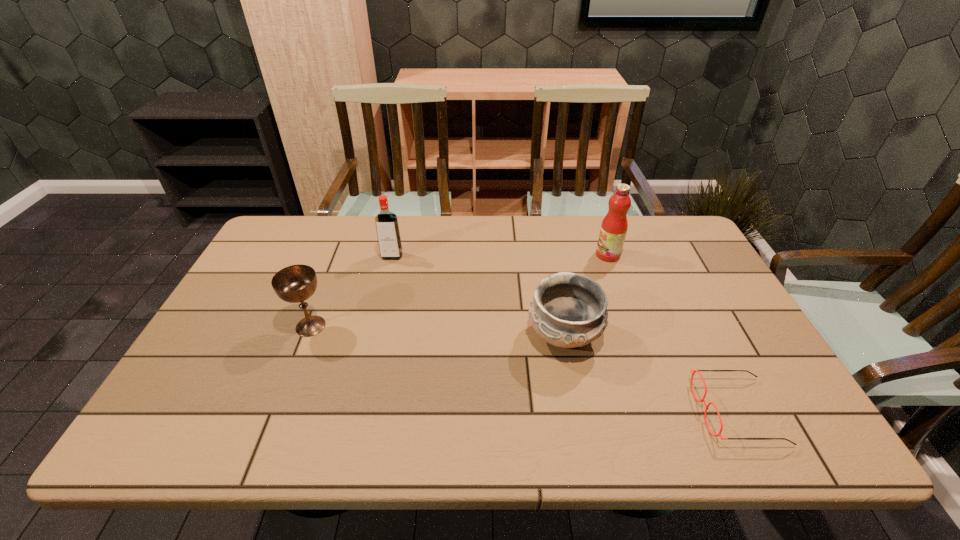
This screenshot has width=960, height=540. Identify the location of object present at the near right corner. (702, 400).

In the image, there is a desktop. Where is `vacant space at the far edge`? vacant space at the far edge is located at coordinates (478, 217).

I want to click on free space at the near edge, so (x=438, y=442).

Image resolution: width=960 pixels, height=540 pixels. What are the coordinates of `free space at the left edge` in the screenshot? It's located at (264, 283).

In the image, there is a desktop. In order to click on vacant area at the right edge in this screenshot , I will do coord(730,306).

At what (x,y) coordinates should I click in order to perform the action: click on free region at the far left corner of the desktop. Please return your answer as a coordinate pair (x, y). The height and width of the screenshot is (540, 960). Looking at the image, I should click on (284, 231).

This screenshot has width=960, height=540. What are the coordinates of `vacant space at the far right corner of the desktop` in the screenshot? It's located at (677, 235).

Locate an element on the screen. The width and height of the screenshot is (960, 540). vacant space that's between the third object from right to left and the leftmost object is located at coordinates (437, 331).

Where is `empty space between the fourth object from right to left and the fruit juice`? The width and height of the screenshot is (960, 540). empty space between the fourth object from right to left and the fruit juice is located at coordinates (500, 255).

At what (x,y) coordinates should I click in order to perform the action: click on vacant area that lies between the third object from right to left and the vodka. Please return your answer as a coordinate pair (x, y). The height and width of the screenshot is (540, 960). Looking at the image, I should click on (478, 296).